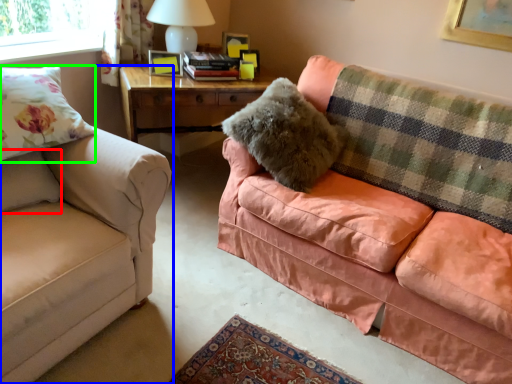
Question: Considering the real-world distances, which object is farthest from pillow (highlighted by a red box)? studio couch (highlighted by a blue box) or throw pillow (highlighted by a green box)?

Choices:
 (A) studio couch
 (B) throw pillow

Answer: (A)